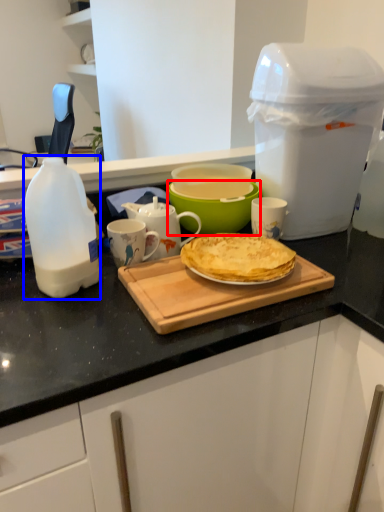
Question: Which object appears farthest to the camera in this image, bowl (highlighted by a red box) or bottle (highlighted by a blue box)?

Choices:
 (A) bowl
 (B) bottle

Answer: (A)